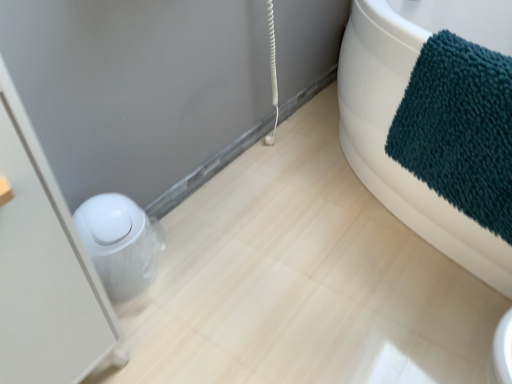
Question: Is teal plush towel at upper right further to the viewer compared to white glossy toilet bowl at lower left?

Choices:
 (A) yes
 (B) no

Answer: (B)

Question: Does teal plush towel at upper right contain white glossy toilet bowl at lower left?

Choices:
 (A) yes
 (B) no

Answer: (B)

Question: Considering the relative sizes of teal plush towel at upper right and white glossy toilet bowl at lower left in the image provided, is teal plush towel at upper right wider than white glossy toilet bowl at lower left?

Choices:
 (A) no
 (B) yes

Answer: (B)

Question: Is teal plush towel at upper right facing towards white glossy toilet bowl at lower left?

Choices:
 (A) yes
 (B) no

Answer: (A)

Question: Is teal plush towel at upper right turned away from white glossy toilet bowl at lower left?

Choices:
 (A) yes
 (B) no

Answer: (B)

Question: Which is correct: white glossy trash can at left is inside teal plush towel at upper right, or outside of it?

Choices:
 (A) inside
 (B) outside

Answer: (B)

Question: Is white glossy trash can at left bigger or smaller than teal plush towel at upper right?

Choices:
 (A) small
 (B) big

Answer: (B)

Question: Considering their positions, is white glossy trash can at left located in front of or behind teal plush towel at upper right?

Choices:
 (A) front
 (B) behind

Answer: (A)

Question: In terms of width, does white glossy trash can at left look wider or thinner when compared to teal plush towel at upper right?

Choices:
 (A) wide
 (B) thin

Answer: (A)

Question: From a real-world perspective, is white glossy toilet bowl at lower left positioned above or below white glossy trash can at left?

Choices:
 (A) below
 (B) above

Answer: (A)

Question: Does point (115, 291) appear closer or farther from the camera than point (25, 230)?

Choices:
 (A) farther
 (B) closer

Answer: (A)

Question: From the image's perspective, relative to white glossy trash can at left, is white glossy toilet bowl at lower left above or below?

Choices:
 (A) below
 (B) above

Answer: (A)

Question: In terms of height, does white glossy toilet bowl at lower left look taller or shorter compared to white glossy trash can at left?

Choices:
 (A) short
 (B) tall

Answer: (A)

Question: In terms of height, does white glossy toilet bowl at lower left look taller or shorter compared to teal plush towel at upper right?

Choices:
 (A) tall
 (B) short

Answer: (B)

Question: Is white glossy toilet bowl at lower left wider or thinner than teal plush towel at upper right?

Choices:
 (A) wide
 (B) thin

Answer: (B)